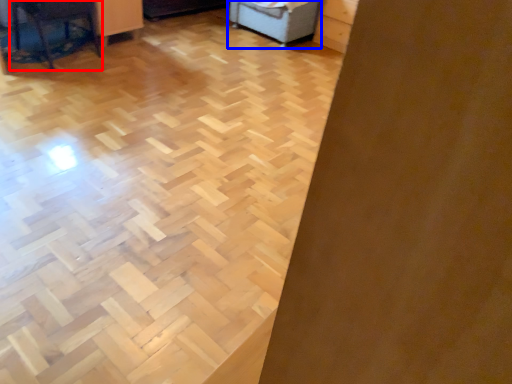
Question: Which object is closer to the camera taking this photo, furniture (highlighted by a red box) or furniture (highlighted by a blue box)?

Choices:
 (A) furniture
 (B) furniture

Answer: (A)